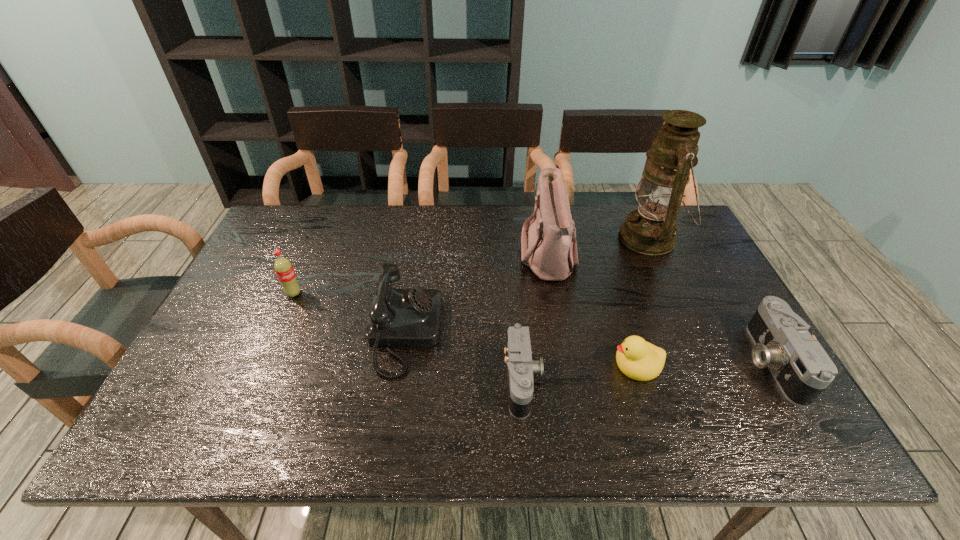
You are a GUI agent. You are given a task and a screenshot of the screen. Output one action in this format:
    pyautogui.click(x=<x>, y=<y>)
    Task: Click on the free spot located on the face of the duckling
    
    Given the screenshot: What is the action you would take?
    517,364

Identify the location of vacant space located 0.180m on the face of the duckling. The width and height of the screenshot is (960, 540). (538, 364).

You are a GUI agent. You are given a task and a screenshot of the screen. Output one action in this format:
    pyautogui.click(x=<x>, y=<y>)
    Task: Click on the shoulder bag that is at the far edge
    The height and width of the screenshot is (540, 960).
    Given the screenshot: What is the action you would take?
    pyautogui.click(x=549, y=248)

Locate an element on the screen. The image size is (960, 540). oil lamp that is positioned at the far edge is located at coordinates (650, 230).

Find the location of a particular element. The height and width of the screenshot is (540, 960). telephone that is positioned at the near edge is located at coordinates (398, 317).

This screenshot has width=960, height=540. I want to click on duckling at the near edge, so click(x=638, y=359).

Image resolution: width=960 pixels, height=540 pixels. I want to click on object that is positioned at the left edge, so click(x=283, y=267).

This screenshot has width=960, height=540. Identify the location of camera present at the right edge. (802, 369).

In order to click on oil lamp at the right edge in this screenshot , I will do pyautogui.click(x=650, y=230).

The image size is (960, 540). Identify the location of object located in the far right corner section of the desktop. (650, 230).